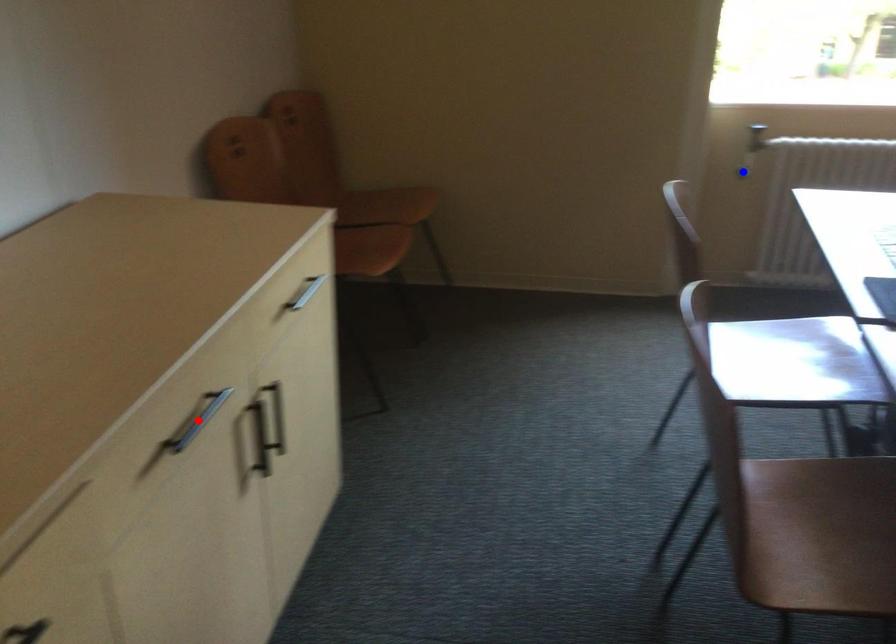
Question: In the image, two points are highlighted. Which point is nearer to the camera? Reply with the corresponding letter.

Choices:
 (A) blue point
 (B) red point

Answer: (B)